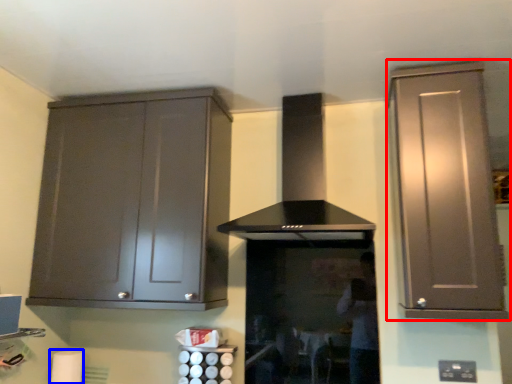
Question: Which point is closer to the camera, cabinetry (highlighted by a red box) or toilet paper (highlighted by a blue box)?

Choices:
 (A) cabinetry
 (B) toilet paper

Answer: (A)